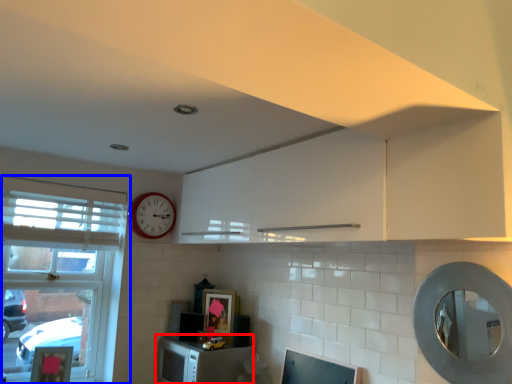
Question: Which object is further to the camera taking this photo, cabinetry (highlighted by a red box) or window (highlighted by a blue box)?

Choices:
 (A) cabinetry
 (B) window

Answer: (A)